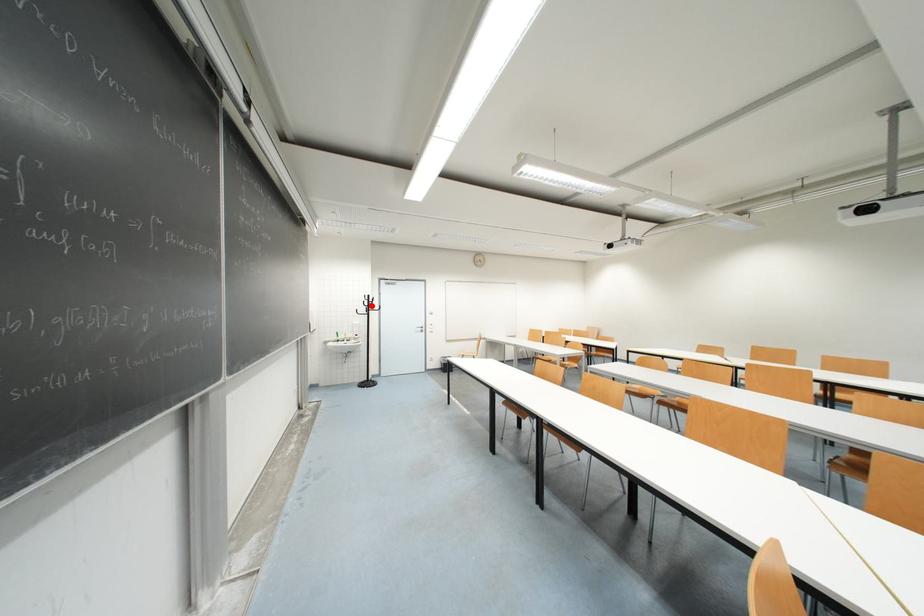
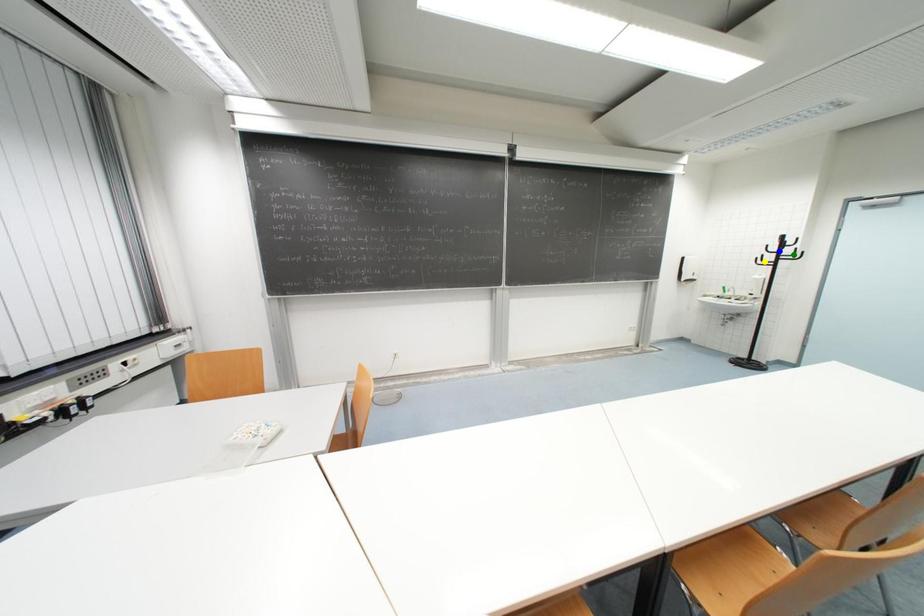
Question: I am providing you with two images of the same scene from different viewpoints. A red point is marked on the first image. You are given multiple points on the second image. Which point in image 2 represents the same 3d spot as the red point in image 1?

Choices:
 (A) yellow point
 (B) green point
 (C) blue point

Answer: (C)